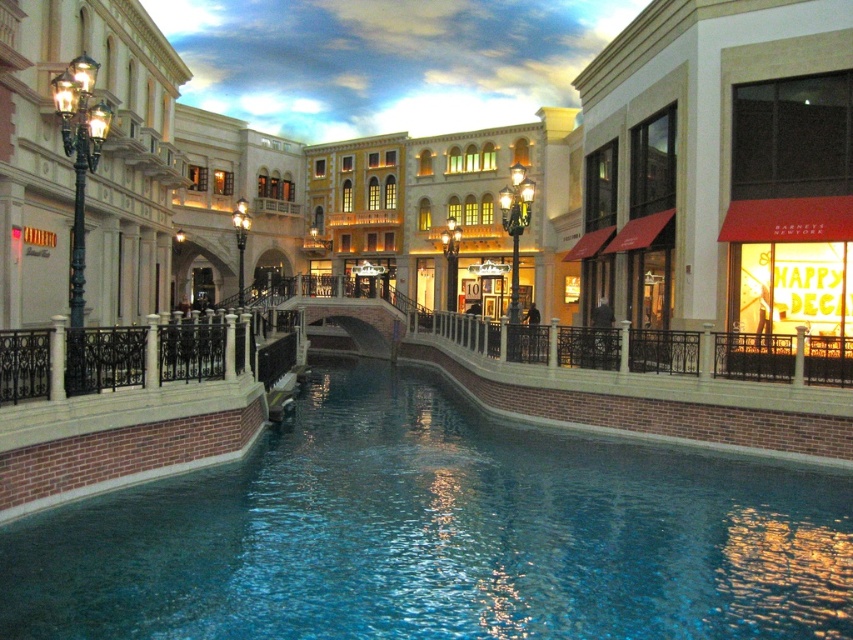
Question: Among these points, which one is farthest from the camera?

Choices:
 (A) (131, 609)
 (B) (53, 33)

Answer: (B)

Question: Does blue smooth water at center lie behind matte black lamppost at left?

Choices:
 (A) no
 (B) yes

Answer: (A)

Question: Which object is the farthest from the matte black lamppost at left?

Choices:
 (A) matte red awning at right
 (B) blue smooth water at center

Answer: (A)

Question: Is matte red awning at right to the left of matte black lamppost at left from the viewer's perspective?

Choices:
 (A) yes
 (B) no

Answer: (B)

Question: Which of the following is the closest to the observer?

Choices:
 (A) (18, 13)
 (B) (421, 573)
 (C) (660, 202)

Answer: (B)

Question: Does matte red awning at right have a larger size compared to matte black lamppost at left?

Choices:
 (A) no
 (B) yes

Answer: (A)